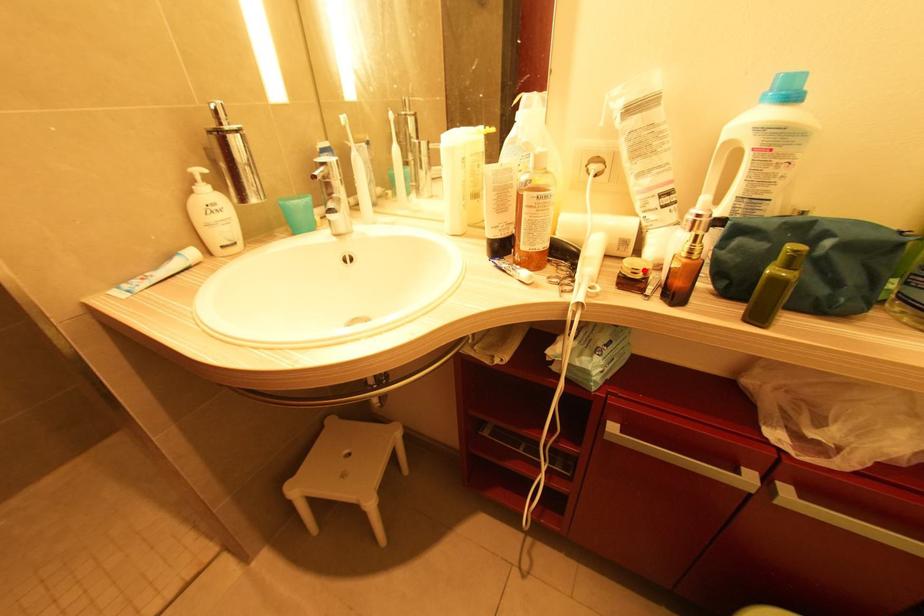
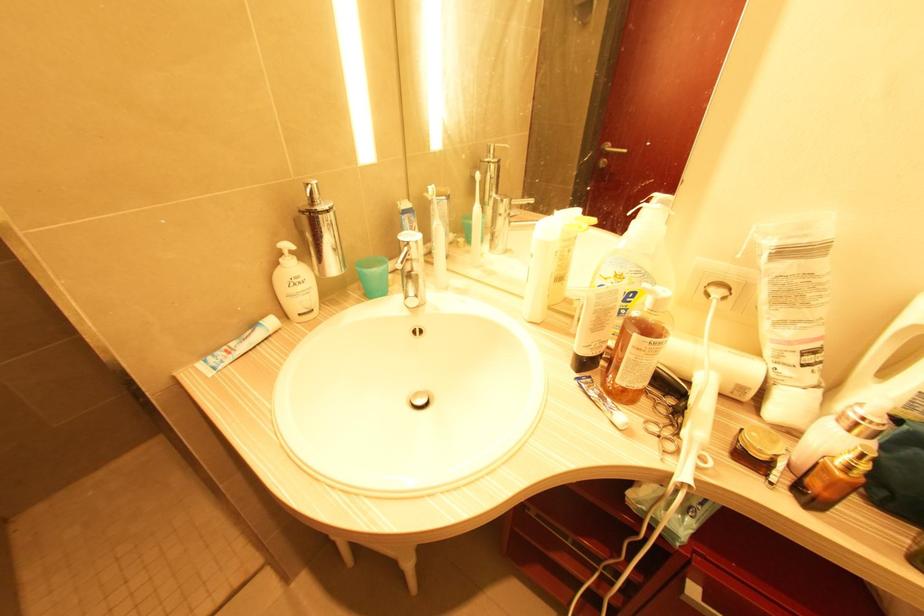
In the second image, find the point that corresponds to the highlighted location in the first image.

(773, 454)